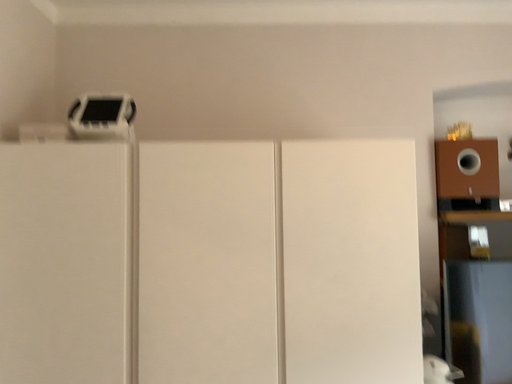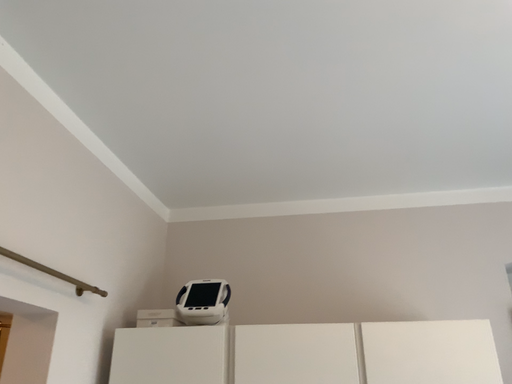
Question: Which way did the camera rotate in the video?

Choices:
 (A) rotated right
 (B) rotated left

Answer: (B)